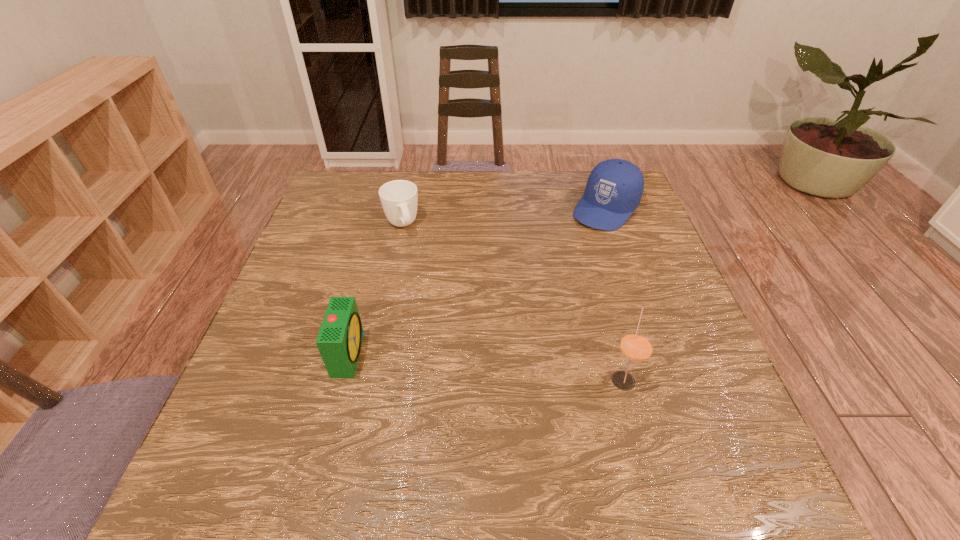
You are a GUI agent. You are given a task and a screenshot of the screen. Output one action in this format:
    pyautogui.click(x=<x>, y=<y>)
    Task: Click on the vacant spot on the desktop that is between the alarm clock and the tallest object and is positioned on the front-facing side of the cap
    
    Given the screenshot: What is the action you would take?
    pyautogui.click(x=467, y=364)

Locate an element on the screen. This screenshot has width=960, height=540. vacant space on the desktop that is between the alarm clock and the tallest object and is positioned with the handle on the side of the cup is located at coordinates (460, 364).